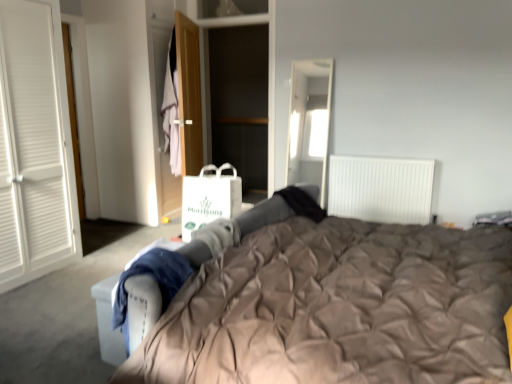
Question: Is white paper shopping bag at center next to wooden door at center?

Choices:
 (A) yes
 (B) no

Answer: (B)

Question: Is white paper shopping bag at center not near wooden door at center?

Choices:
 (A) yes
 (B) no

Answer: (A)

Question: Does white paper shopping bag at center have a larger size compared to wooden door at center?

Choices:
 (A) yes
 (B) no

Answer: (B)

Question: Is white paper shopping bag at center positioned before wooden door at center?

Choices:
 (A) no
 (B) yes

Answer: (B)

Question: Can you confirm if white paper shopping bag at center is shorter than wooden door at center?

Choices:
 (A) yes
 (B) no

Answer: (A)

Question: Is white paper shopping bag at center at the right side of wooden door at center?

Choices:
 (A) no
 (B) yes

Answer: (B)

Question: Is light pink fabric at center beside white paper shopping bag at center?

Choices:
 (A) yes
 (B) no

Answer: (B)

Question: From the image's perspective, does light pink fabric at center appear higher than white paper shopping bag at center?

Choices:
 (A) no
 (B) yes

Answer: (B)

Question: Is light pink fabric at center positioned behind white paper shopping bag at center?

Choices:
 (A) yes
 (B) no

Answer: (A)

Question: Can you confirm if light pink fabric at center is taller than white paper shopping bag at center?

Choices:
 (A) no
 (B) yes

Answer: (B)

Question: Is white paper shopping bag at center inside light pink fabric at center?

Choices:
 (A) yes
 (B) no

Answer: (B)

Question: Is light pink fabric at center positioned with its back to white paper shopping bag at center?

Choices:
 (A) yes
 (B) no

Answer: (B)

Question: Is matte brown duvet at center not inside white paper shopping bag at center?

Choices:
 (A) no
 (B) yes

Answer: (B)